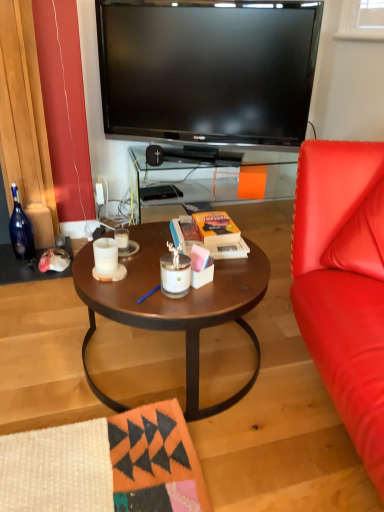
In order to click on vacant area to the right of white matte candle at center, which appears as the first coffee cup when viewed from the front in this screenshot , I will do `click(150, 273)`.